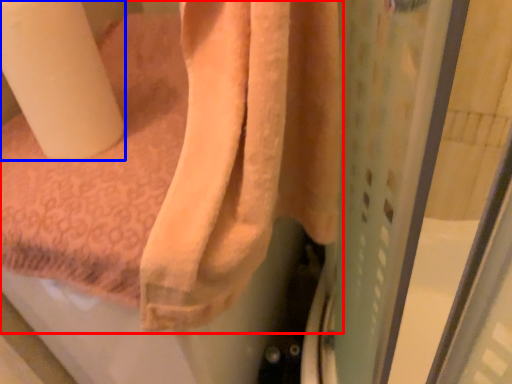
Question: Which point is further to the camera, towel (highlighted by a red box) or toilet paper (highlighted by a blue box)?

Choices:
 (A) towel
 (B) toilet paper

Answer: (B)